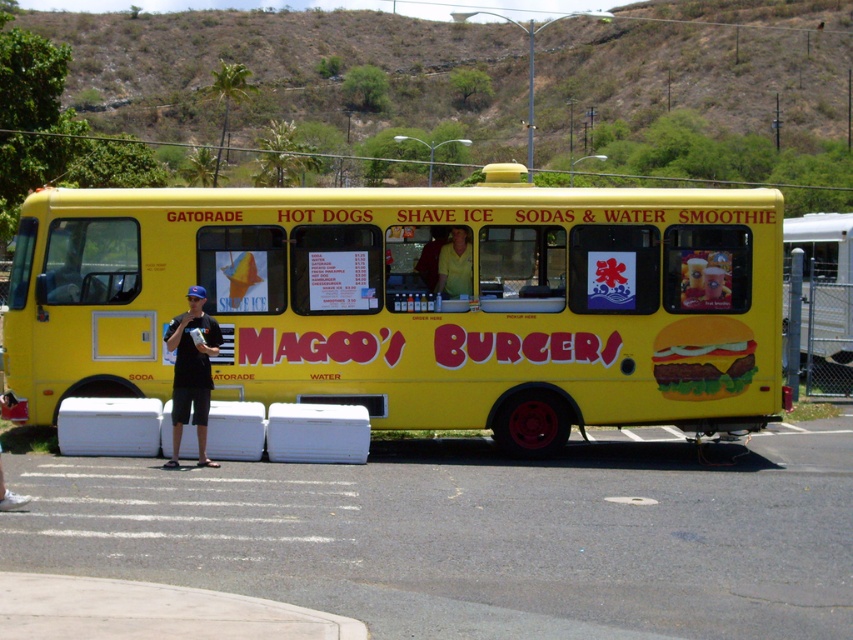
You are a customer standing in front of the food truck and want to place an order. You notice the concrete at lower left and the yellow matte hamburger at center. Which object is wider?

The concrete at lower left is wider than the yellow matte hamburger at center.

You are a customer standing at the food truck and looking at the menu. You notice the concrete at lower left and the yellow matte shirt at center. Which object is located below the other?

The concrete at lower left is positioned under the yellow matte shirt at center.